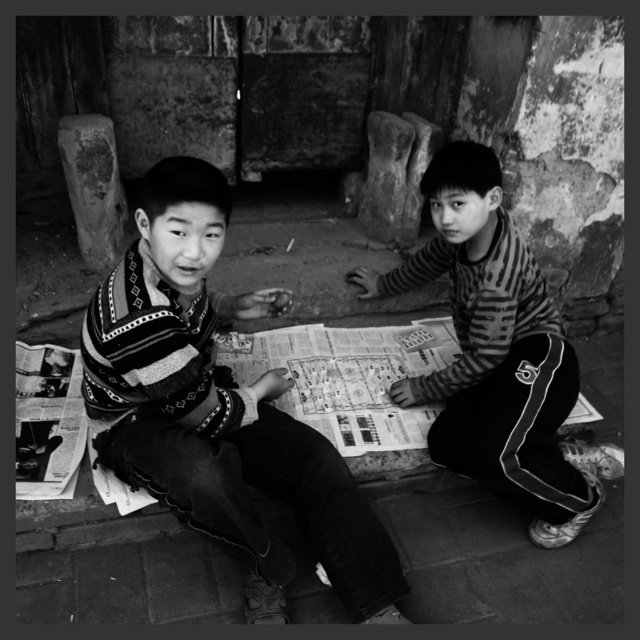
You are standing in front of the image and want to locate the striped fabric shirt at center. Where is it positioned in terms of coordinates?

The striped fabric shirt at center is positioned at coordinates point (497,355).

You are a photographer trying to capture both the striped fabric shirt at center and the printed paper game at center in a single frame. Which object should you focus on first to ensure both are in the frame?

The striped fabric shirt at center is larger than the printed paper game at center, so you should focus on the striped fabric shirt at center first to ensure both fit within the frame.

You are a photographer trying to capture a closeup of both the striped sweater at center and the printed paper game at center. Since you can only focus on one object at a time, which object should you choose to ensure the other fits within the frame?

The striped sweater at center has a lesser width compared to the printed paper game at center, so you should focus on the printed paper game at center to ensure the smaller striped sweater at center fits within the frame.